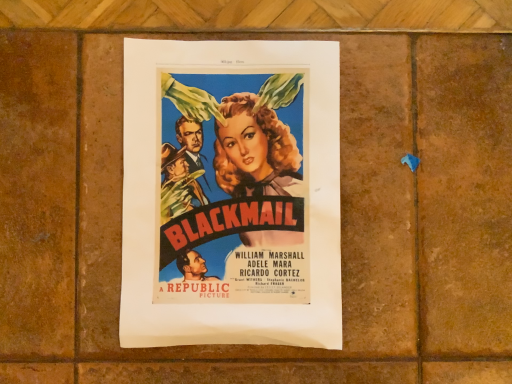
Question: Should I look upward or downward to see matte paper poster at center?

Choices:
 (A) up
 (B) down

Answer: (A)